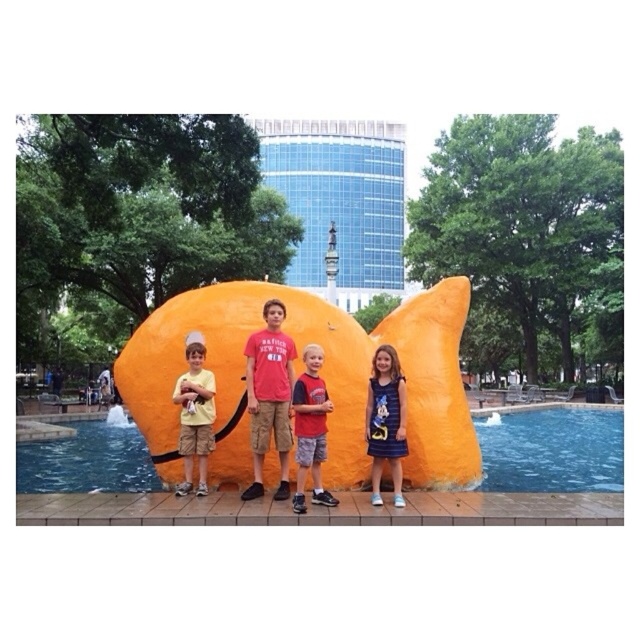
You are a photographer trying to capture a photo of the children in front of the orange sculpture. You notice the red cotton shirt at center and the matte yellow shorts at center. Which clothing item appears shorter in the photo?

The red cotton shirt at center appears shorter than the matte yellow shorts at center because the red cotton shirt at center is not as tall as matte yellow shorts at center.

You are standing at the camera position and want to reach the point marked at coordinates (317, 474). The path to this point is 30 feet wide. Can you safely walk to the point without crossing the water?

The point marked at coordinates (317, 474) is 31.53 feet away from the camera. Since the path is 30 feet wide, you would need to walk along the path to reach it. However, the distance to the point exceeds the path width, so you might have to step onto the water, which is not safe. Therefore, it is not safe to walk to the point without crossing the water.